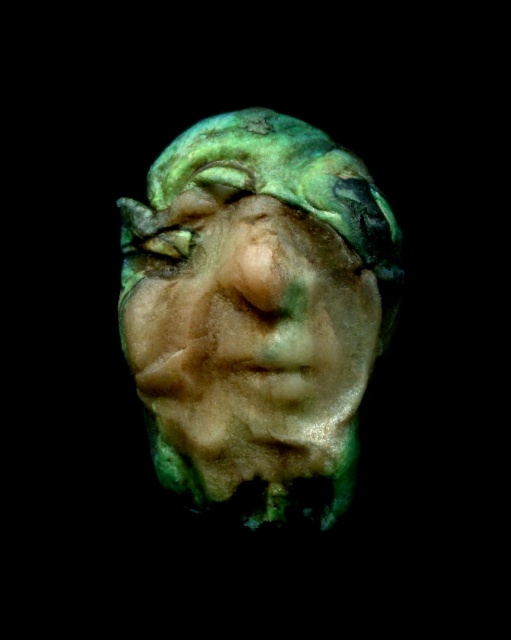
Question: Among these points, which one is farthest from the camera?

Choices:
 (A) (201, 474)
 (B) (136, 241)

Answer: (B)

Question: Is green metallic mask at center further to camera compared to green matte eye at center?

Choices:
 (A) yes
 (B) no

Answer: (B)

Question: Is green metallic mask at center closer to camera compared to green matte eye at center?

Choices:
 (A) no
 (B) yes

Answer: (B)

Question: Is green metallic mask at center bigger than green matte eye at center?

Choices:
 (A) yes
 (B) no

Answer: (A)

Question: Which point is closer to the camera?

Choices:
 (A) green metallic mask at center
 (B) green matte eye at center

Answer: (A)